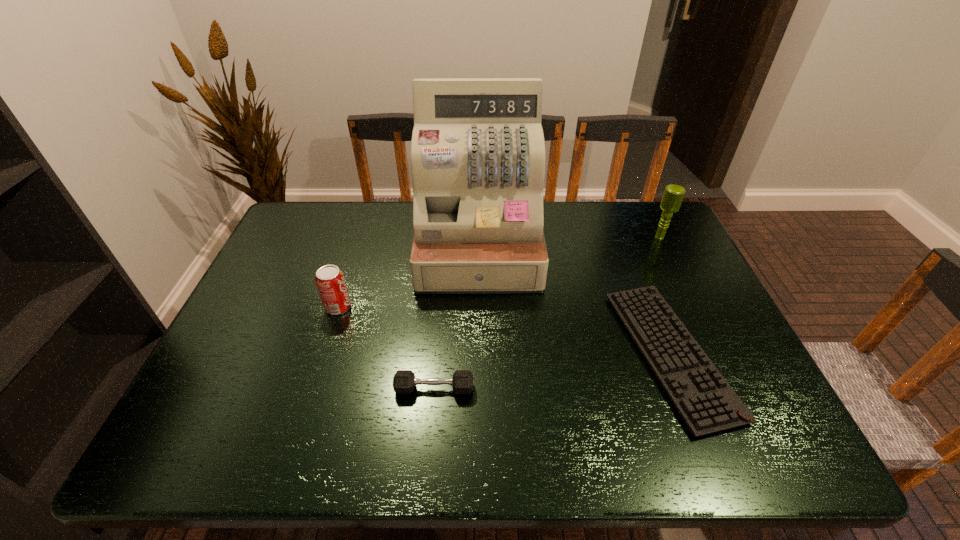
You are a GUI agent. You are given a task and a screenshot of the screen. Output one action in this format:
    pyautogui.click(x=<x>, y=<y>)
    Task: Click on the free region at the left edge of the desktop
    The height and width of the screenshot is (540, 960).
    Given the screenshot: What is the action you would take?
    pyautogui.click(x=263, y=269)

Image resolution: width=960 pixels, height=540 pixels. In the image, there is a desktop. What are the coordinates of `free space at the right edge` in the screenshot? It's located at [x=684, y=254].

You are a GUI agent. You are given a task and a screenshot of the screen. Output one action in this format:
    pyautogui.click(x=<x>, y=<y>)
    Task: Click on the vacant point located between the shortest object and the dumbbell
    This screenshot has width=960, height=540.
    Given the screenshot: What is the action you would take?
    pyautogui.click(x=552, y=371)

You are a GUI agent. You are given a task and a screenshot of the screen. Output one action in this format:
    pyautogui.click(x=<x>, y=<y>)
    Task: Click on the vacant area between the cash register and the third shortest object
    The height and width of the screenshot is (540, 960).
    Given the screenshot: What is the action you would take?
    pyautogui.click(x=409, y=276)

Find the location of a particular element. Image resolution: width=960 pixels, height=540 pixels. empty space that is in between the leftmost object and the second shortest object is located at coordinates (386, 348).

The width and height of the screenshot is (960, 540). Identify the location of free area in between the second tallest object and the dumbbell. (547, 313).

Locate an element on the screen. This screenshot has width=960, height=540. blank region between the shortest object and the tallest object is located at coordinates (574, 300).

Locate an element on the screen. Image resolution: width=960 pixels, height=540 pixels. free spot between the third tallest object and the second shortest object is located at coordinates (386, 348).

This screenshot has height=540, width=960. Find the location of `free space between the second tallest object and the shortest object`. free space between the second tallest object and the shortest object is located at coordinates (664, 296).

At what (x,y) coordinates should I click in order to perform the action: click on blank region between the fourth tallest object and the cash register. Please return your answer as a coordinate pair (x, y). The image size is (960, 540). Looking at the image, I should click on (456, 317).